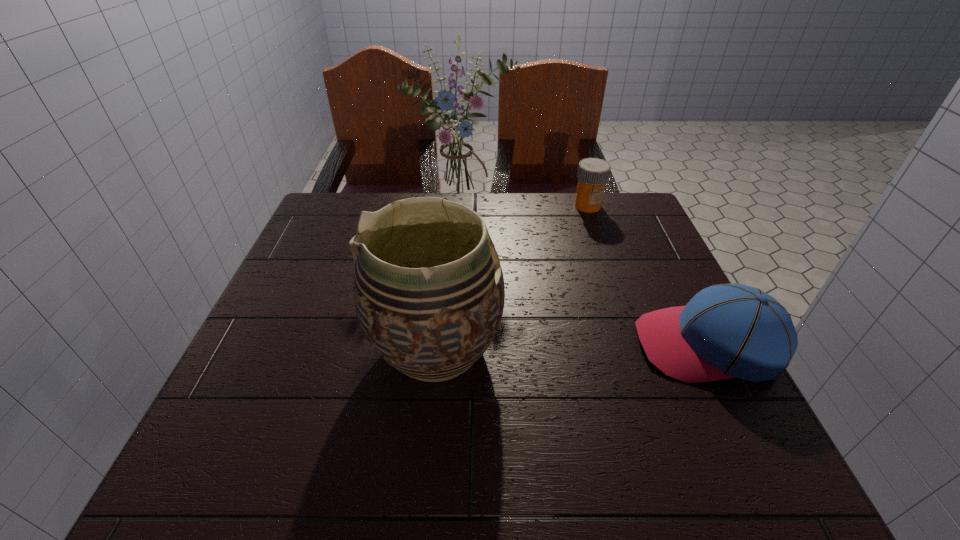
Identify the location of the third shortest object. (429, 294).

The image size is (960, 540). I want to click on baseball cap, so click(x=725, y=331).

Identify the location of bouquet. Image resolution: width=960 pixels, height=540 pixels. (458, 173).

This screenshot has height=540, width=960. Identify the location of medicine. 593,173.

I want to click on free location located 0.160m on the right of the pottery, so click(585, 348).

At what (x,y) coordinates should I click in order to perform the action: click on vacant point located on the front-facing side of the baseball cap. Please return your answer as a coordinate pair (x, y). The height and width of the screenshot is (540, 960). Looking at the image, I should click on (495, 345).

Find the location of a particular element. The width and height of the screenshot is (960, 540). free space located on the front-facing side of the baseball cap is located at coordinates (612, 345).

You are a GUI agent. You are given a task and a screenshot of the screen. Output one action in this format:
    pyautogui.click(x=<x>, y=<y>)
    Task: Click on the vacant position located 0.290m on the front-facing side of the baseball cap
    Image resolution: width=960 pixels, height=540 pixels.
    Given the screenshot: What is the action you would take?
    pyautogui.click(x=490, y=345)

Identify the location of blank space located on the front-facing side of the tallest object. (503, 249).

The height and width of the screenshot is (540, 960). What are the coordinates of `vacant space located on the front-facing side of the tallest object` in the screenshot? It's located at (553, 308).